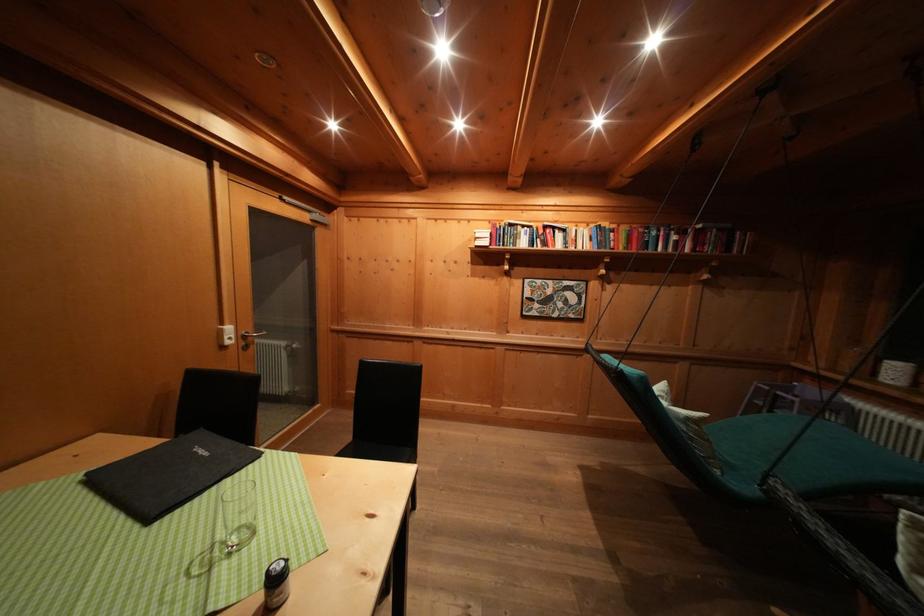
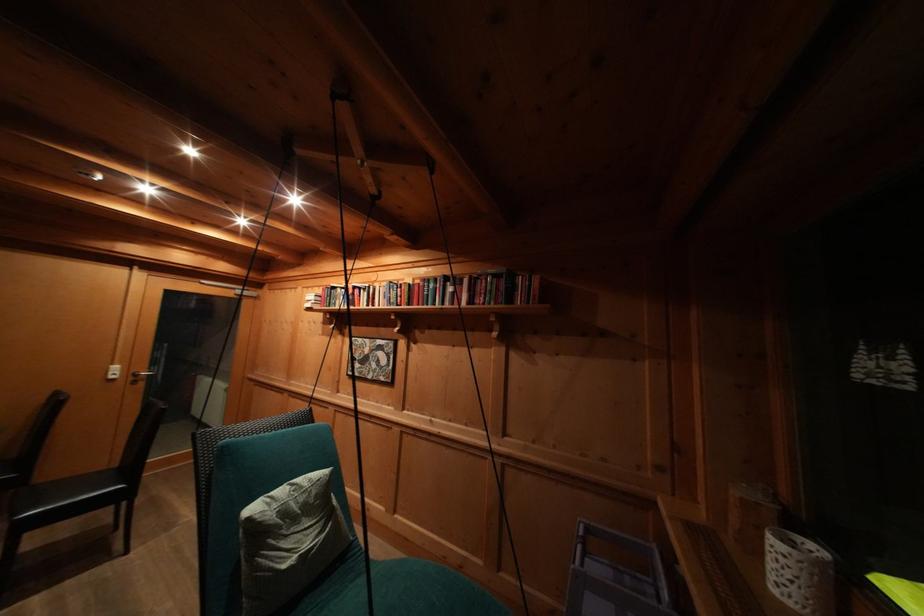
Find the pixel in the second image that matches point 661,238 in the first image.

(438, 291)